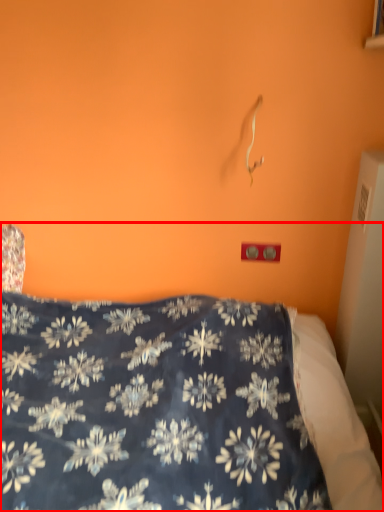
Question: From the image, what is the correct spatial relationship of bed (annotated by the red box) in relation to electric outlet?

Choices:
 (A) right
 (B) left

Answer: (B)